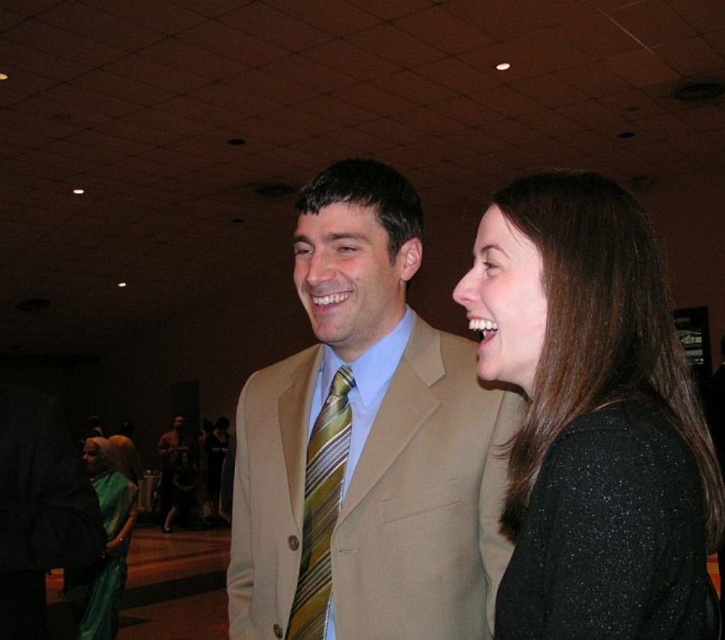
Which is above, black sparkly dress at right or brown leather jacket at lower left?

black sparkly dress at right is higher up.

Is black sparkly dress at right further to camera compared to brown leather jacket at lower left?

No, it is in front of brown leather jacket at lower left.

The width and height of the screenshot is (725, 640). I want to click on black sparkly dress at right, so click(610, 536).

The width and height of the screenshot is (725, 640). In order to click on black sparkly dress at right in this screenshot , I will do [x=610, y=536].

Can you confirm if tan fabric suit at center is shorter than black sparkly sweater at right?

No, tan fabric suit at center is not shorter than black sparkly sweater at right.

Is point (254, 611) closer to camera compared to point (500, 221)?

No, it is not.

At what (x,y) coordinates should I click in order to perform the action: click on tan fabric suit at center. Please return your answer as a coordinate pair (x, y). The image size is (725, 640). Looking at the image, I should click on (365, 444).

Who is taller, black sparkly dress at right or yellow striped tie at center?

yellow striped tie at center

Does black sparkly dress at right appear on the left side of yellow striped tie at center?

No, black sparkly dress at right is not to the left of yellow striped tie at center.

Does point (700, 568) come behind point (323, 440)?

That is False.

Image resolution: width=725 pixels, height=640 pixels. Identify the location of black sparkly dress at right. (610, 536).